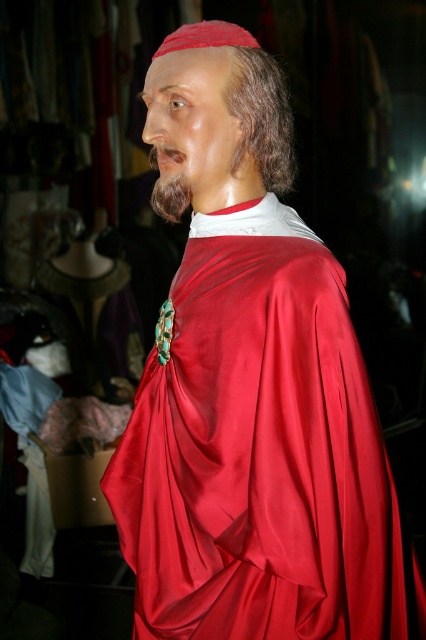
Identify the location of satin red robe at center. This screenshot has width=426, height=640. (258, 449).

Between satin red robe at center and dark brown silky hair at upper center, which one has more height?

With more height is satin red robe at center.

In order to click on satin red robe at center in this screenshot , I will do pyautogui.click(x=258, y=449).

Between dark brown silky hair at upper center and brown fuzzy beard at center, which one appears on the left side from the viewer's perspective?

brown fuzzy beard at center is more to the left.

Between point (236, 163) and point (169, 196), which one is positioned in front?

Positioned in front is point (236, 163).

At what (x,y) coordinates should I click in order to perform the action: click on dark brown silky hair at upper center. Please return your answer as a coordinate pair (x, y). This screenshot has width=426, height=640. Looking at the image, I should click on (261, 116).

Is the position of satin red robe at center less distant than that of brown fuzzy beard at center?

Yes, it is in front of brown fuzzy beard at center.

Is point (264, 369) positioned behind point (166, 180)?

No, (264, 369) is closer to viewer.

Where is `satin red robe at center`? This screenshot has width=426, height=640. satin red robe at center is located at coordinates [x=258, y=449].